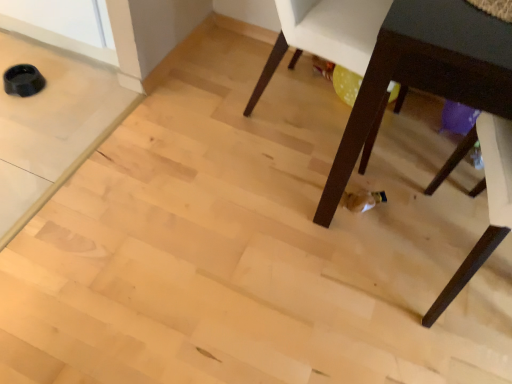
Locate an element on the screen. This screenshot has width=512, height=384. free space between dark wood chair at lower right, arranged as the 2th chair when viewed from the left, and white plastic chair at center, which is the first chair in top-to-bottom order is located at coordinates (374, 195).